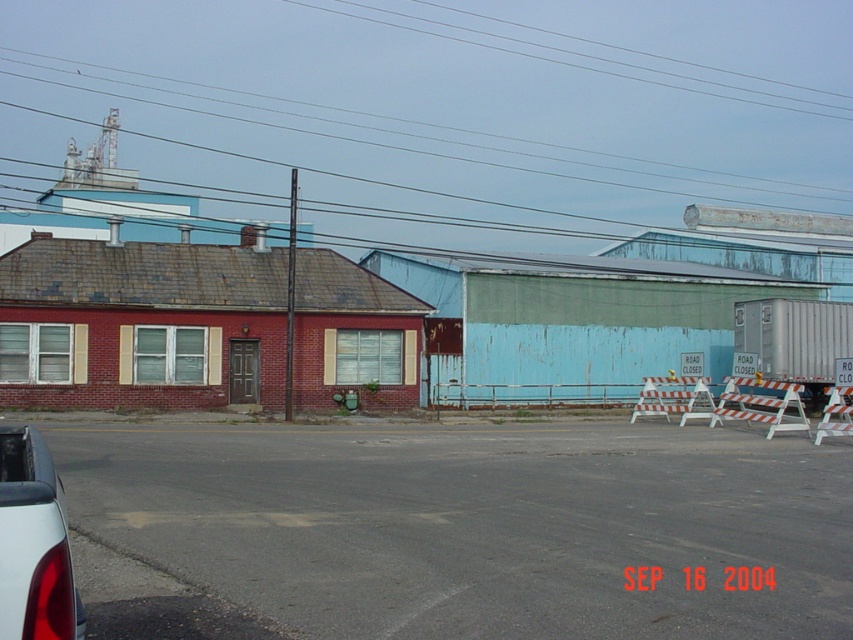
Does matte black car at lower left appear on the left side of clear wire at upper center?

Correct, you'll find matte black car at lower left to the left of clear wire at upper center.

Does matte black car at lower left appear over clear wire at upper center?

No.

Image resolution: width=853 pixels, height=640 pixels. Describe the element at coordinates (33, 544) in the screenshot. I see `matte black car at lower left` at that location.

Locate an element on the screen. The image size is (853, 640). matte black car at lower left is located at coordinates (33, 544).